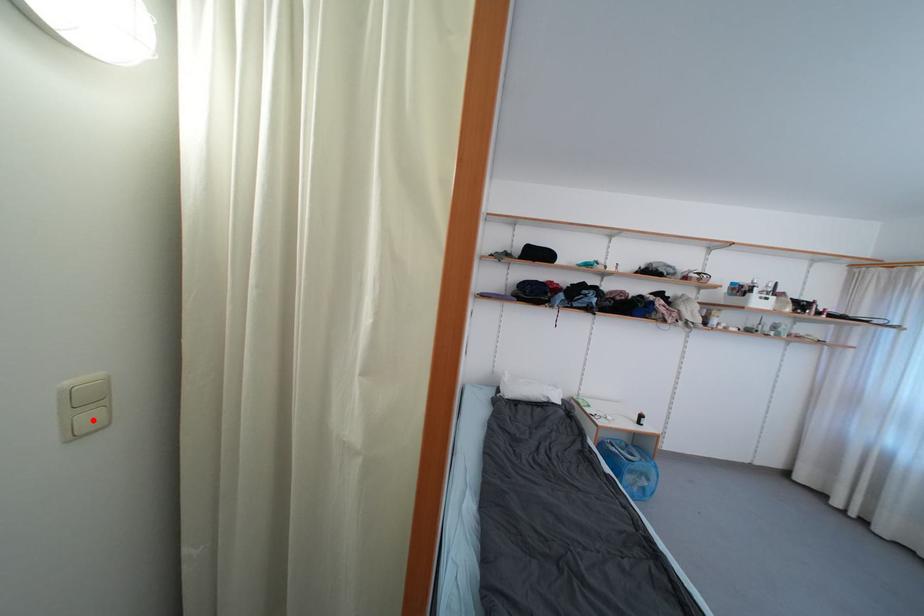
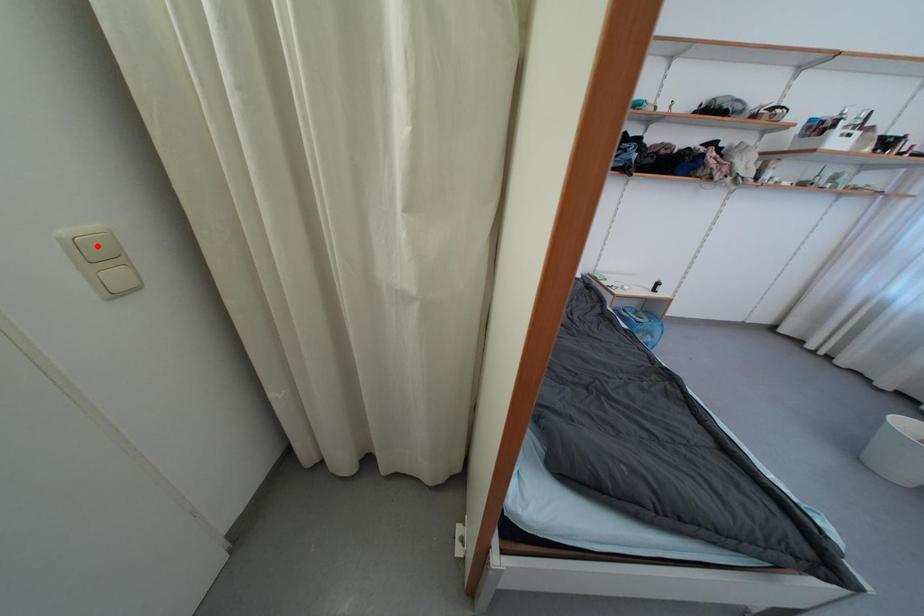
I am providing you with two images of the same scene from different viewpoints. A red point is marked on the first image and another point is marked on the second image. Do the highlighted points in image1 and image2 indicate the same real-world spot?

No